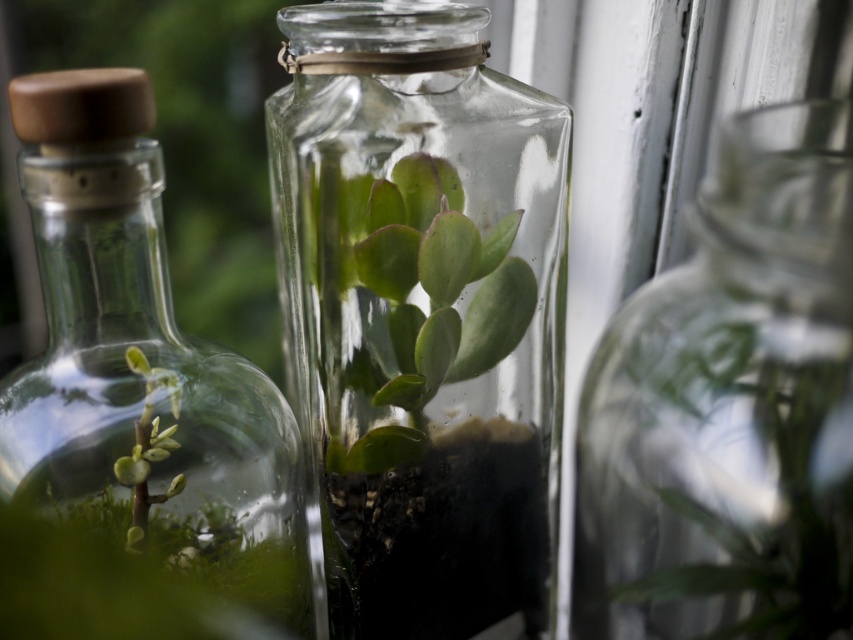
Question: Which point is closer to the camera?

Choices:
 (A) green matte succulent at center
 (B) clear glass bottle at left

Answer: (B)

Question: Is transparent glass vase at center to the left of clear glass bottle at left from the viewer's perspective?

Choices:
 (A) yes
 (B) no

Answer: (B)

Question: Which of the following is the farthest from the observer?

Choices:
 (A) transparent glass vase at right
 (B) clear glass bottle at left

Answer: (B)

Question: Estimate the real-world distances between objects in this image. Which object is closer to the transparent glass vase at center?

Choices:
 (A) green matte succulent at center
 (B) clear glass bottle at left

Answer: (A)

Question: Can you confirm if transparent glass vase at center is wider than transparent glass vase at right?

Choices:
 (A) no
 (B) yes

Answer: (B)

Question: From the image, what is the correct spatial relationship of transparent glass vase at right in relation to green matte succulent at center?

Choices:
 (A) right
 (B) left

Answer: (A)